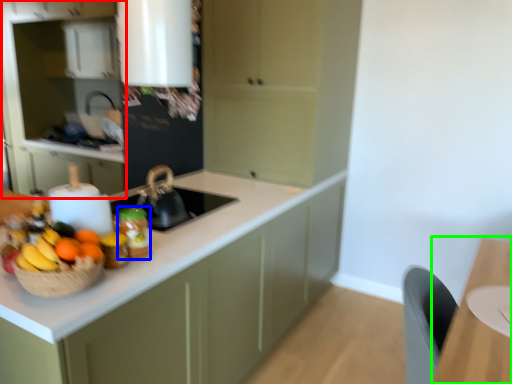
Question: Considering the real-world distances, which object is closest to cabinetry (highlighted by a red box)? kitchen appliance (highlighted by a blue box) or table (highlighted by a green box).

Choices:
 (A) kitchen appliance
 (B) table

Answer: (A)